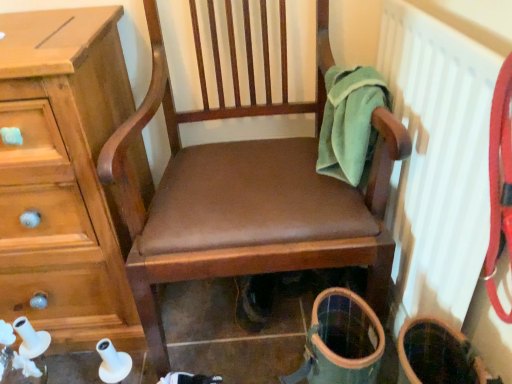
Question: Is white textured radiator at upper right positioned before brown leather chair at center?

Choices:
 (A) no
 (B) yes

Answer: (B)

Question: Are white textured radiator at upper right and brown leather chair at center located far from each other?

Choices:
 (A) no
 (B) yes

Answer: (A)

Question: Can you see white textured radiator at upper right touching brown leather chair at center?

Choices:
 (A) yes
 (B) no

Answer: (B)

Question: Is white textured radiator at upper right completely or partially outside of brown leather chair at center?

Choices:
 (A) no
 (B) yes

Answer: (B)

Question: Is white textured radiator at upper right at the left side of brown leather chair at center?

Choices:
 (A) no
 (B) yes

Answer: (A)

Question: Can you confirm if white textured radiator at upper right is smaller than brown leather chair at center?

Choices:
 (A) yes
 (B) no

Answer: (A)

Question: Is green fleece towel at upper right in front of white textured radiator at upper right?

Choices:
 (A) yes
 (B) no

Answer: (B)

Question: Could you tell me if green fleece towel at upper right is facing white textured radiator at upper right?

Choices:
 (A) yes
 (B) no

Answer: (B)

Question: From a real-world perspective, is green fleece towel at upper right located beneath white textured radiator at upper right?

Choices:
 (A) no
 (B) yes

Answer: (A)

Question: Can you confirm if green fleece towel at upper right is positioned to the left of white textured radiator at upper right?

Choices:
 (A) no
 (B) yes

Answer: (B)

Question: Would you say green fleece towel at upper right is outside white textured radiator at upper right?

Choices:
 (A) no
 (B) yes

Answer: (B)

Question: Is green fleece towel at upper right far away from white textured radiator at upper right?

Choices:
 (A) no
 (B) yes

Answer: (A)

Question: Considering the relative sizes of brown leather chair at center and green fleece towel at upper right in the image provided, is brown leather chair at center bigger than green fleece towel at upper right?

Choices:
 (A) yes
 (B) no

Answer: (A)